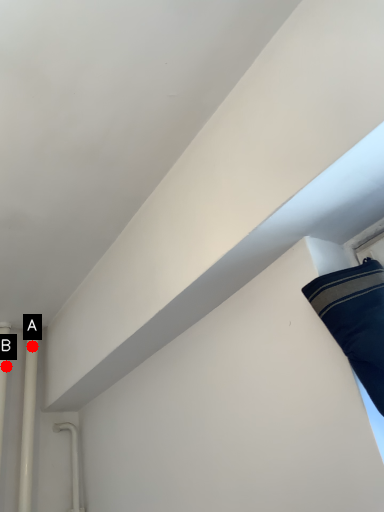
Question: Two points are circled on the image, labeled by A and B beside each circle. Among these points, which one is farthest from the camera?

Choices:
 (A) A is further
 (B) B is further

Answer: (A)